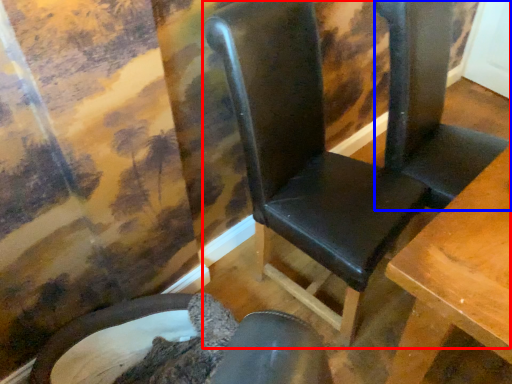
Question: Among these objects, which one is farthest to the camera, chair (highlighted by a red box) or folding chair (highlighted by a blue box)?

Choices:
 (A) chair
 (B) folding chair

Answer: (B)